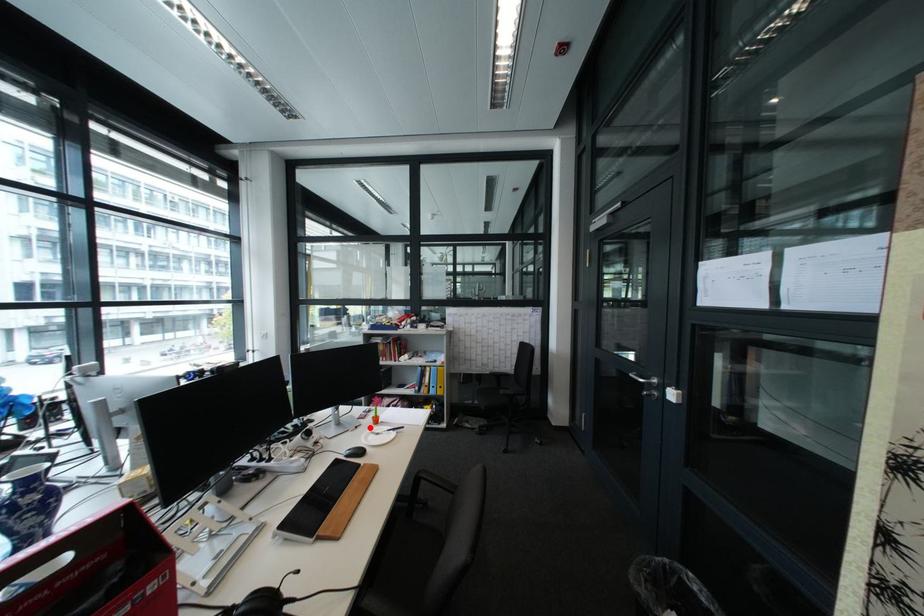
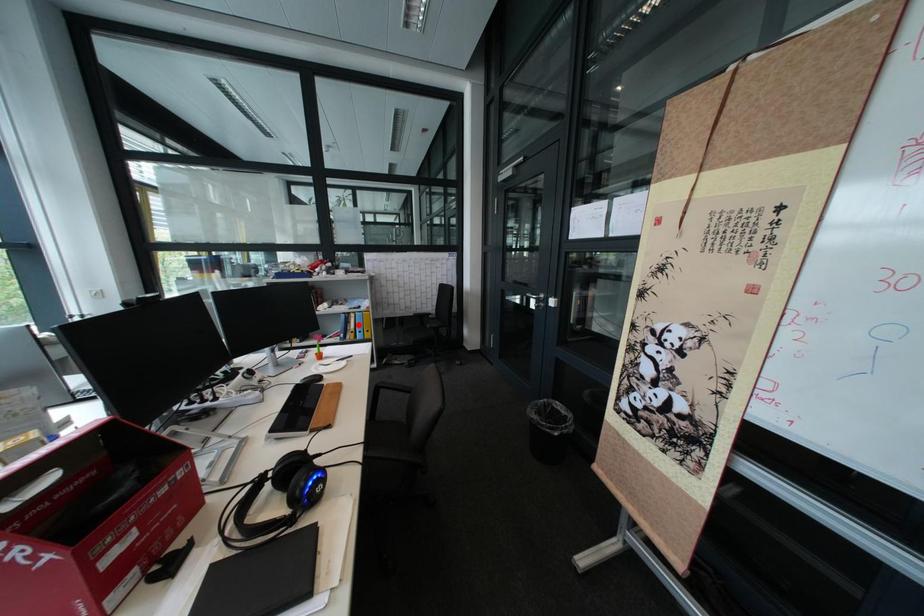
I am providing you with two images of the same scene from different viewpoints. A red point is marked on the first image and another point is marked on the second image. Does the point marked in image1 correspond to the same location as the one in image2?

No